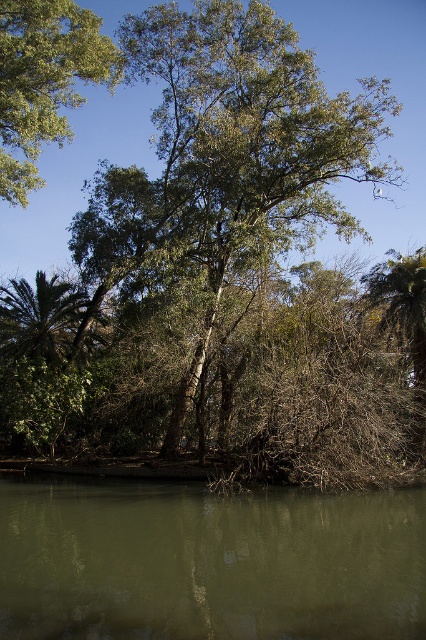
Question: Which point is closer to the camera taking this photo?

Choices:
 (A) (91, 29)
 (B) (138, 536)
 (C) (69, 288)

Answer: (B)

Question: Among these objects, which one is nearest to the camera?

Choices:
 (A) green leafy tree at upper left
 (B) green leafy palm tree at left
 (C) green leafy tree at center

Answer: (A)

Question: Considering the relative positions of green leafy tree at center and green leafy tree at upper left in the image provided, where is green leafy tree at center located with respect to green leafy tree at upper left?

Choices:
 (A) left
 (B) right

Answer: (B)

Question: Is green leafy tree at center positioned before green leafy palm tree at left?

Choices:
 (A) no
 (B) yes

Answer: (B)

Question: Where is green murky water at lower center located in relation to green leafy tree at upper left in the image?

Choices:
 (A) right
 (B) left

Answer: (A)

Question: Which point is closer to the camera taking this photo?

Choices:
 (A) (23, 152)
 (B) (172, 497)
 (C) (115, 212)
 (D) (69, 348)

Answer: (B)